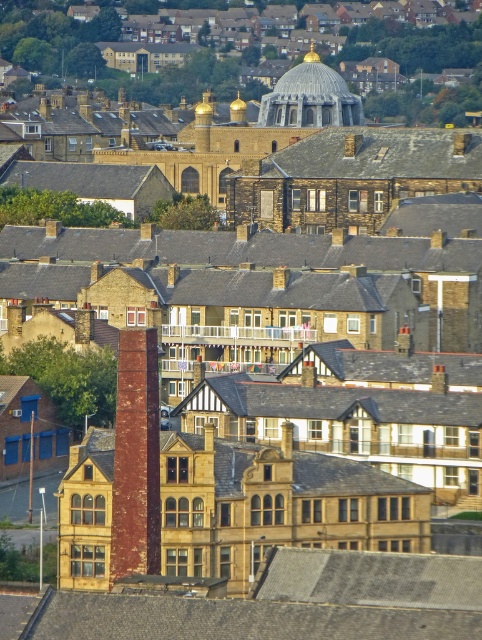
Question: Which object is closer to the camera taking this photo?

Choices:
 (A) red brick chimney at center
 (B) silver metallic dome at center

Answer: (A)

Question: Where is red brick chimney at center located in relation to silver metallic dome at center in the image?

Choices:
 (A) above
 (B) below

Answer: (B)

Question: Does red brick chimney at center have a smaller size compared to silver metallic dome at center?

Choices:
 (A) yes
 (B) no

Answer: (A)

Question: Is red brick chimney at center in front of silver metallic dome at center?

Choices:
 (A) no
 (B) yes

Answer: (B)